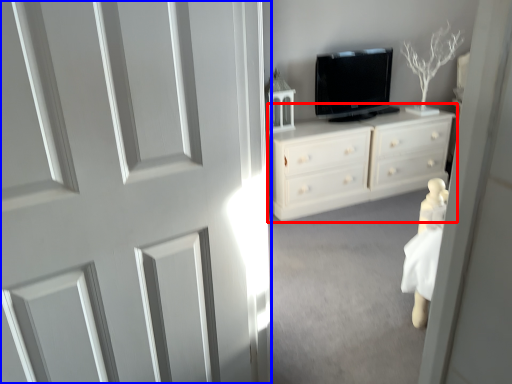
Question: Which object appears farthest to the camera in this image, chest of drawers (highlighted by a red box) or door (highlighted by a blue box)?

Choices:
 (A) chest of drawers
 (B) door

Answer: (A)